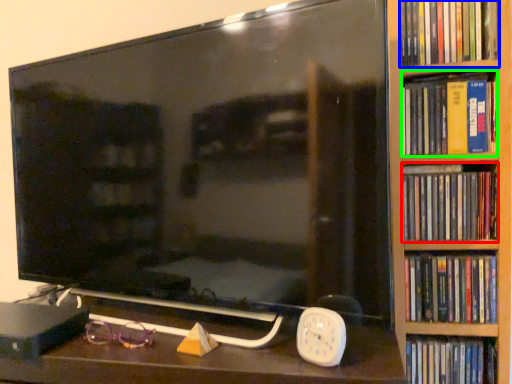
Question: Estimate the real-world distances between objects in this image. Which object is closer to book (highlighted by a red box), book (highlighted by a blue box) or book (highlighted by a green box)?

Choices:
 (A) book
 (B) book

Answer: (B)